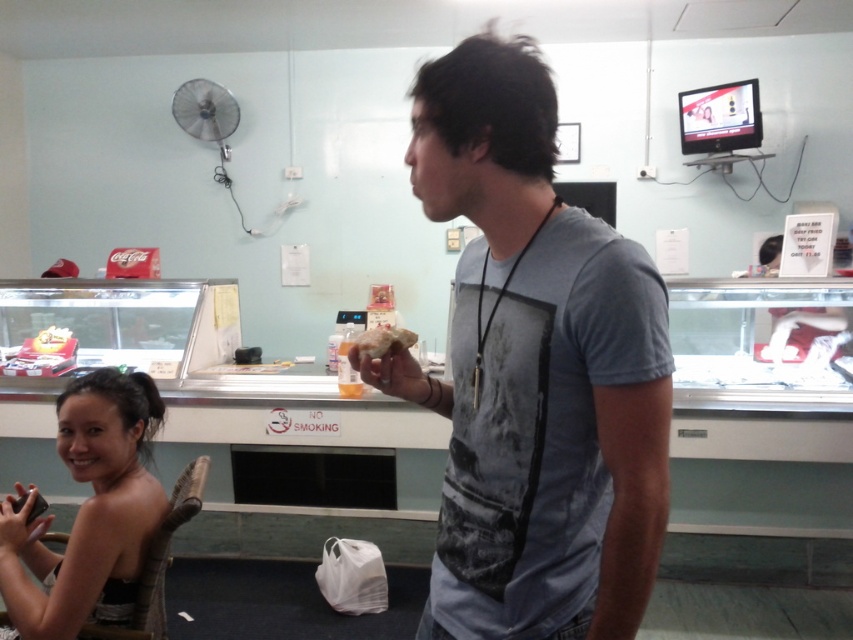
You are standing at point (369, 348) and want to walk to point (157, 412). Is the point you want to reach in front of or behind you?

The point (157, 412) is behind point (369, 348), so the destination is behind you.